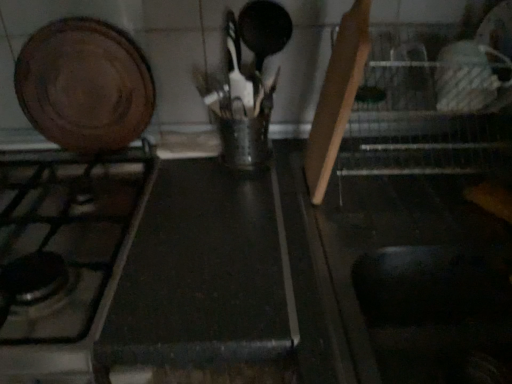
This screenshot has height=384, width=512. I want to click on vacant space to the left of wooden cutting board at upper left, so 30,161.